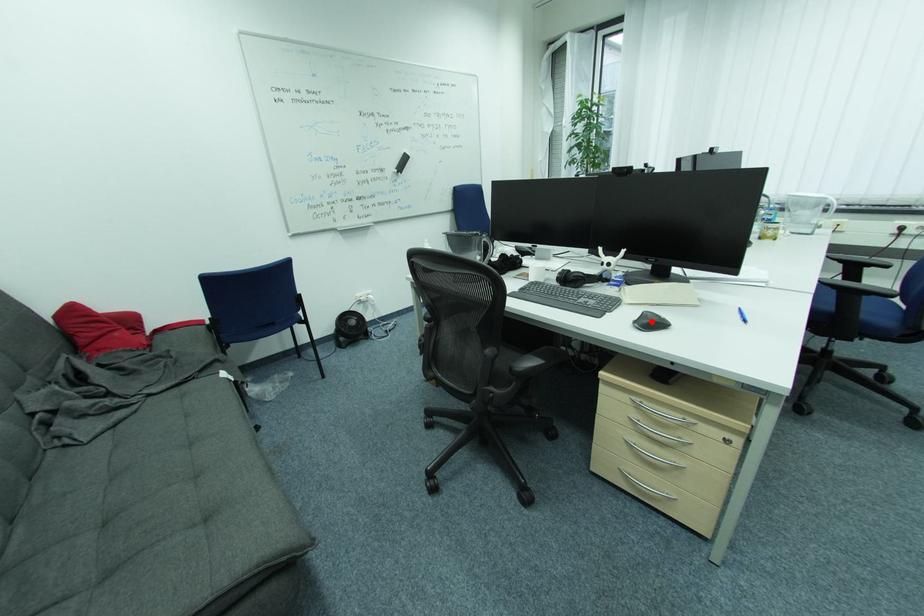
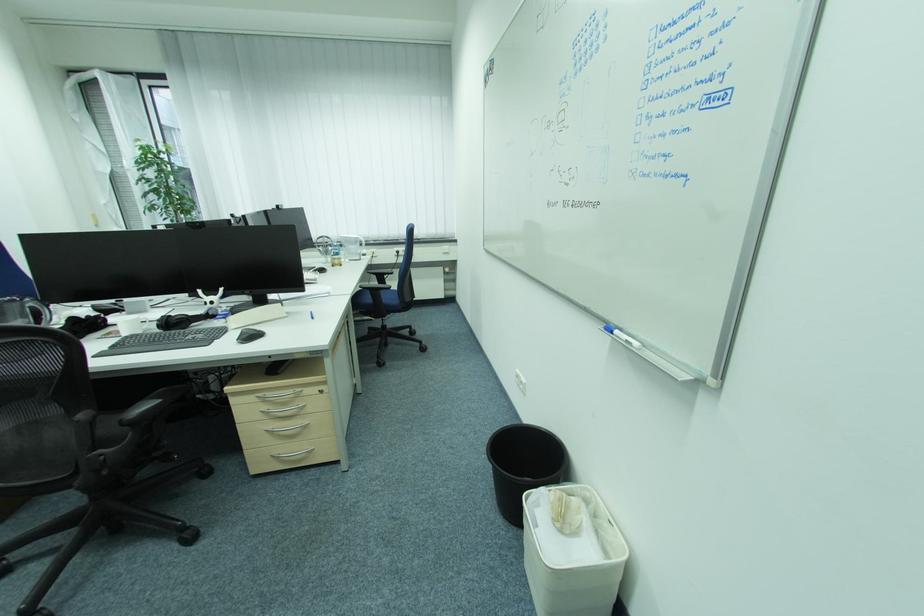
Locate, in the second image, the point that corresponds to the highlighted location in the first image.

(251, 338)